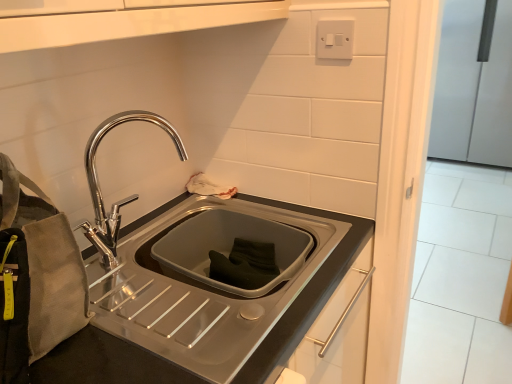
Question: Can you confirm if polished metal faucet at upper left is positioned to the left of canvas pouch at left?

Choices:
 (A) no
 (B) yes

Answer: (A)

Question: Considering the relative sizes of polished metal faucet at upper left and canvas pouch at left in the image provided, is polished metal faucet at upper left taller than canvas pouch at left?

Choices:
 (A) no
 (B) yes

Answer: (A)

Question: Is polished metal faucet at upper left thinner than canvas pouch at left?

Choices:
 (A) no
 (B) yes

Answer: (B)

Question: Is polished metal faucet at upper left bigger than canvas pouch at left?

Choices:
 (A) yes
 (B) no

Answer: (B)

Question: Are polished metal faucet at upper left and canvas pouch at left far apart?

Choices:
 (A) yes
 (B) no

Answer: (B)

Question: Does polished metal faucet at upper left have a lesser height compared to canvas pouch at left?

Choices:
 (A) no
 (B) yes

Answer: (B)

Question: Can we say satin silver refrigerator at right lies outside polished metal faucet at upper left?

Choices:
 (A) no
 (B) yes

Answer: (B)

Question: Is satin silver refrigerator at right smaller than polished metal faucet at upper left?

Choices:
 (A) no
 (B) yes

Answer: (A)

Question: Is satin silver refrigerator at right thinner than polished metal faucet at upper left?

Choices:
 (A) yes
 (B) no

Answer: (B)

Question: Is there a large distance between satin silver refrigerator at right and polished metal faucet at upper left?

Choices:
 (A) no
 (B) yes

Answer: (B)

Question: Considering the relative sizes of satin silver refrigerator at right and polished metal faucet at upper left in the image provided, is satin silver refrigerator at right taller than polished metal faucet at upper left?

Choices:
 (A) yes
 (B) no

Answer: (A)

Question: Is satin silver refrigerator at right aimed at polished metal faucet at upper left?

Choices:
 (A) yes
 (B) no

Answer: (A)

Question: Is satin silver refrigerator at right positioned before canvas pouch at left?

Choices:
 (A) yes
 (B) no

Answer: (B)